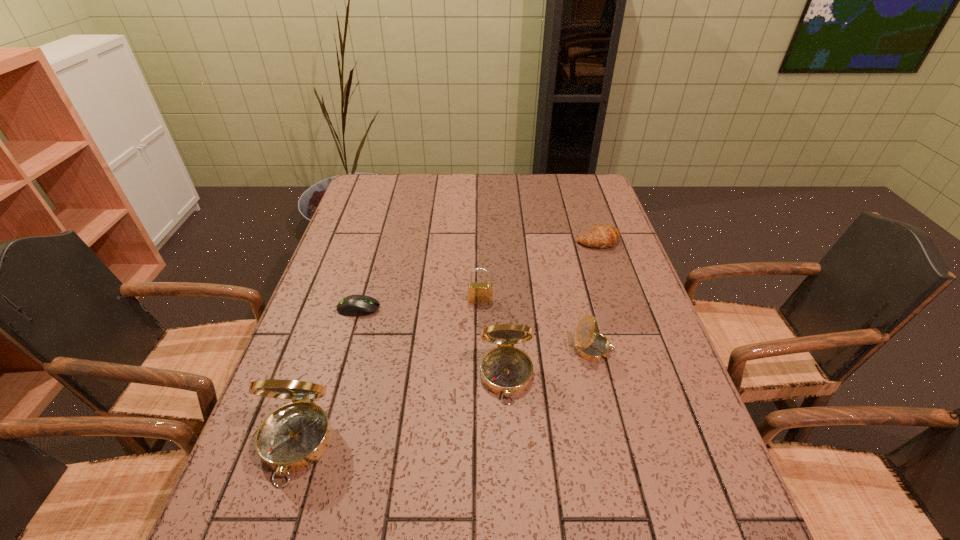
Identify the location of unoccupied area between the crescent roll and the shortest object. The height and width of the screenshot is (540, 960). (478, 275).

Identify the location of vacant space that's between the shortest compass and the fifth tallest object. The width and height of the screenshot is (960, 540). (596, 295).

The image size is (960, 540). Find the location of `free space between the shortest object and the padlock`. free space between the shortest object and the padlock is located at coordinates (420, 305).

Identify the location of free point between the crescent roll and the fifth shortest object. This screenshot has height=540, width=960. (552, 309).

Identify the location of free space that is in between the second tallest compass and the farthest object. This screenshot has width=960, height=540. (552, 309).

Identify which object is the fourth nearest to the nearest compass. Please provide its 2D coordinates. Your answer should be formatted as a tuple, i.e. [(x, y)], where the tuple contains the x and y coordinates of a point satisfying the conditions above.

[(590, 345)]

You are a GUI agent. You are given a task and a screenshot of the screen. Output one action in this format:
    pyautogui.click(x=<x>, y=<y>)
    Task: Click on the object that stands as the second closest to the rightmost compass
    Image resolution: width=960 pixels, height=540 pixels.
    Given the screenshot: What is the action you would take?
    pyautogui.click(x=477, y=292)

Locate which compass is the closest to the second shortest compass. Please provide its 2D coordinates. Your answer should be formatted as a tuple, i.e. [(x, y)], where the tuple contains the x and y coordinates of a point satisfying the conditions above.

[(590, 345)]

Locate an element on the screen. The width and height of the screenshot is (960, 540). compass that is the second closest to the rightmost compass is located at coordinates (294, 436).

Identify the location of free space that satisfies the following two spatial constraints: 1. on the front-facing side of the padlock; 2. on the wheel side of the computer mouse. The height and width of the screenshot is (540, 960). (481, 308).